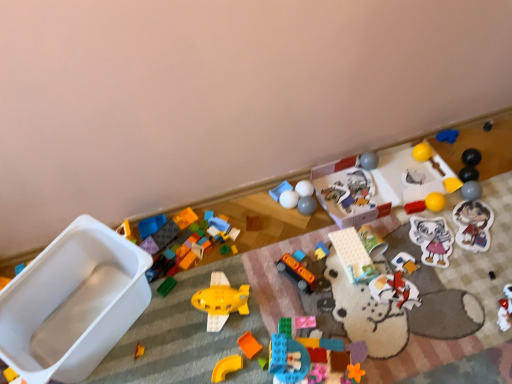
At what (x,y) coordinates should I click in order to perform the action: click on empty space that is in between yellow matte square at center-right, placed as the 22th toy when sorted from left to right, and white matte figure at center, placed as the seventh toy when sorted from right to left. Please return your answer as a coordinate pair (x, y). Looking at the image, I should click on (423, 233).